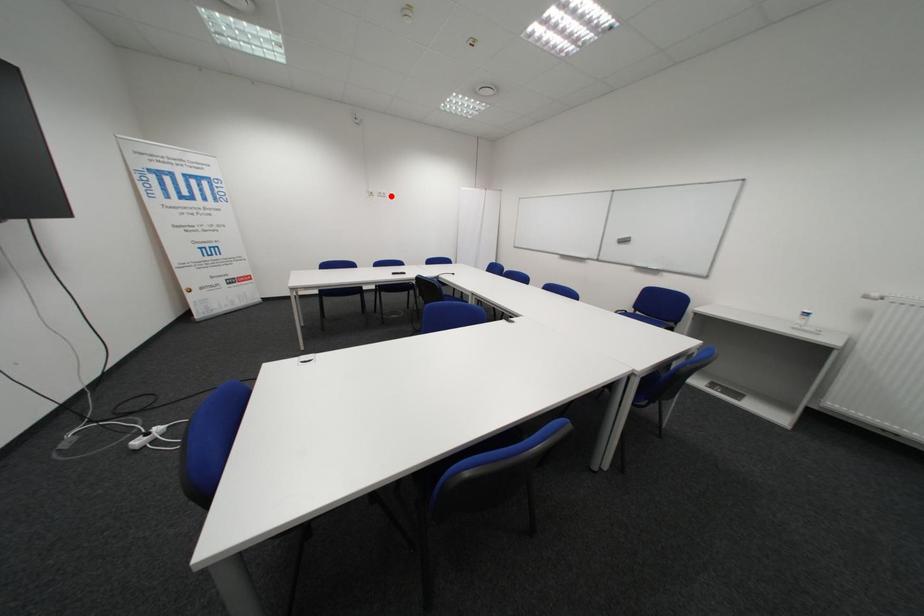
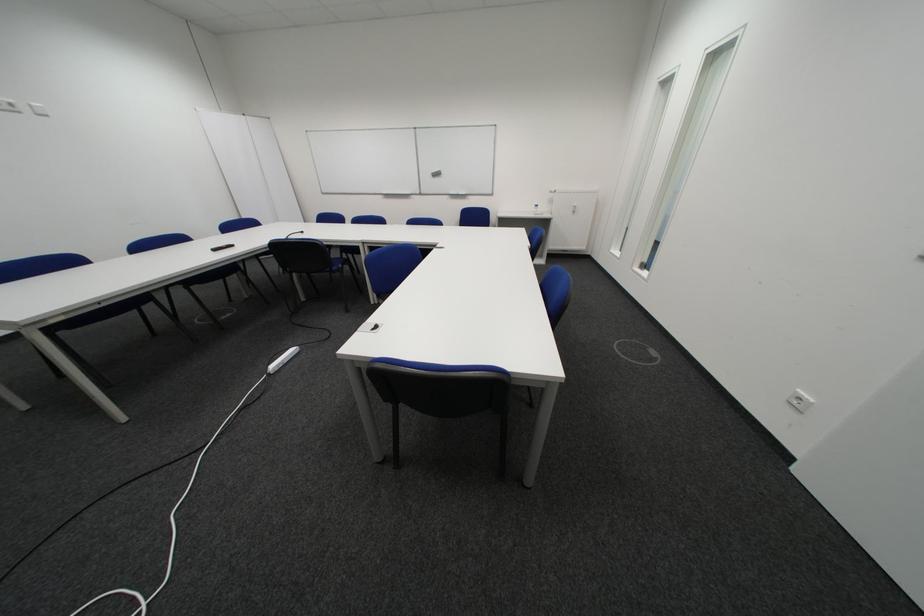
Find the pixel in the second image that matches the highlighted location in the first image.

(8, 108)